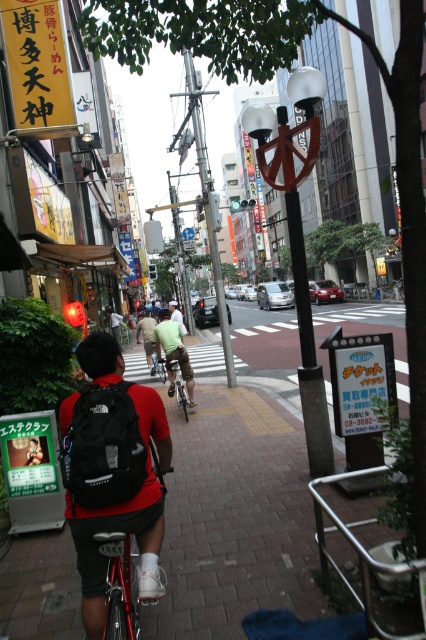
Question: Does green fabric shirt at center have a smaller size compared to light brown fabric shirt at center?

Choices:
 (A) no
 (B) yes

Answer: (B)

Question: Based on their relative distances, which object is nearer to the silver metallic bicycle at center?

Choices:
 (A) light brown fabric shirt at center
 (B) green fabric shirt at center

Answer: (B)

Question: Does silver metallic bicycle at center lie behind light green fabric shirt at center?

Choices:
 (A) no
 (B) yes

Answer: (A)

Question: Which point is farther from the camera taking this photo?

Choices:
 (A) (169, 388)
 (B) (176, 401)

Answer: (B)

Question: Is matte black backpack at center to the right of silver metallic bicycle at center from the viewer's perspective?

Choices:
 (A) no
 (B) yes

Answer: (A)

Question: Which point is closer to the camera?

Choices:
 (A) (175, 326)
 (B) (178, 380)
 (C) (138, 320)

Answer: (A)